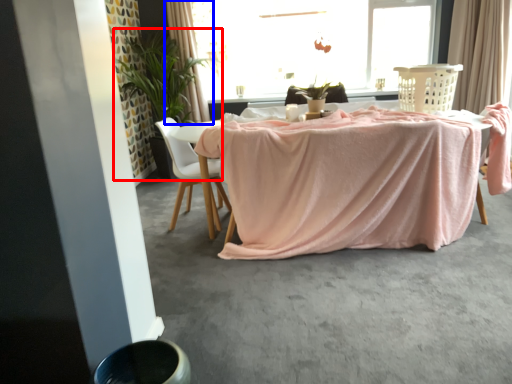
Question: Which object is closer to the camera taking this photo, houseplant (highlighted by a red box) or curtain (highlighted by a blue box)?

Choices:
 (A) houseplant
 (B) curtain

Answer: (A)